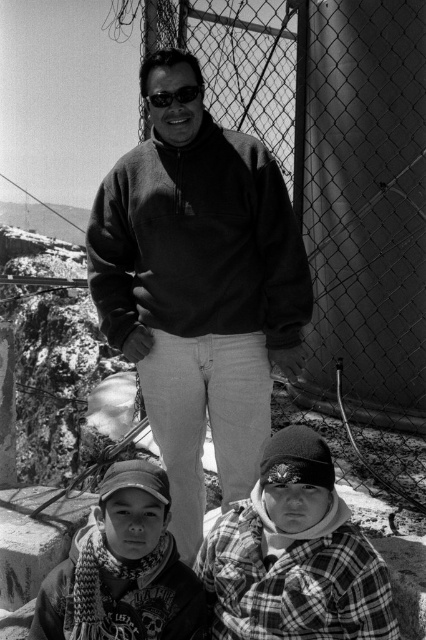
The height and width of the screenshot is (640, 426). Describe the element at coordinates (294, 556) in the screenshot. I see `plaid flannel shirt at lower right` at that location.

Locate an element on the screen. The image size is (426, 640). plaid flannel shirt at lower right is located at coordinates (294, 556).

Between matte black sweatshirt at center and matte black goggles at center, which one has less height?

Standing shorter between the two is matte black goggles at center.

Describe the element at coordinates (198, 243) in the screenshot. I see `matte black sweatshirt at center` at that location.

Find the location of a particular element. The height and width of the screenshot is (640, 426). matte black sweatshirt at center is located at coordinates (198, 243).

Consider the image. Which of these two, dark fleece at center or matte black sweatshirt at center, stands shorter?

matte black sweatshirt at center is shorter.

Identify the location of dark fleece at center. (199, 296).